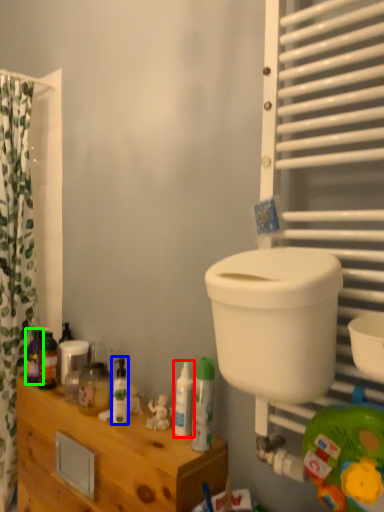
Question: Which object is positioned farthest from toiletry (highlighted by a red box)? Select from toiletry (highlighted by a blue box) and toiletry (highlighted by a green box).

Choices:
 (A) toiletry
 (B) toiletry

Answer: (B)